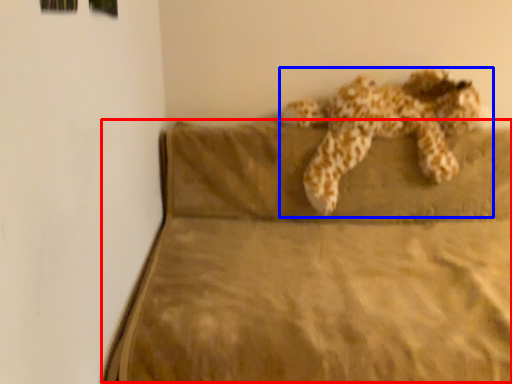
Question: Among these objects, which one is farthest to the camera, mattress (highlighted by a red box) or animal (highlighted by a blue box)?

Choices:
 (A) mattress
 (B) animal

Answer: (B)